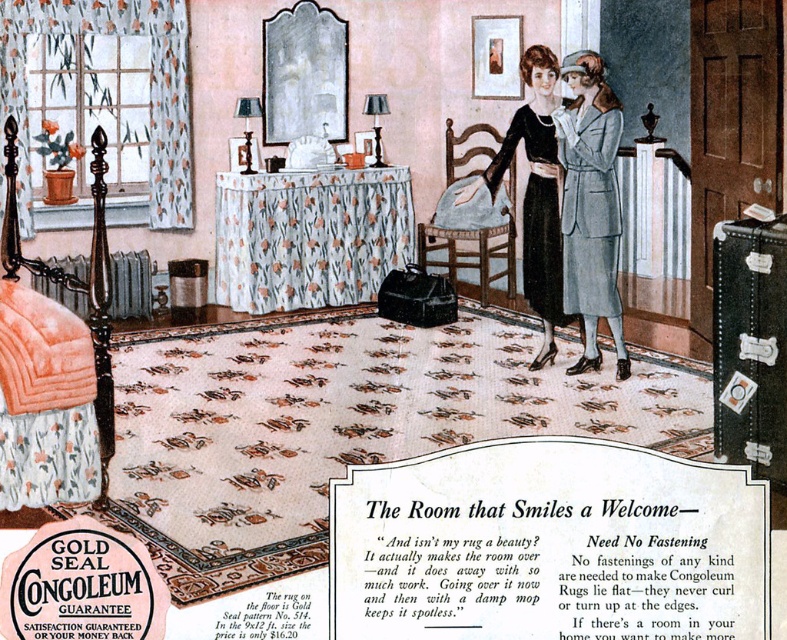
Question: Among these objects, which one is farthest from the camera?

Choices:
 (A) light gray wool suit at center
 (B) matte black dress at center
 (C) white carpet at center

Answer: (B)

Question: Does white carpet at center have a smaller size compared to matte black dress at center?

Choices:
 (A) yes
 (B) no

Answer: (A)

Question: Is the position of white carpet at center less distant than that of light gray wool suit at center?

Choices:
 (A) no
 (B) yes

Answer: (B)

Question: Which object is closer to the camera taking this photo?

Choices:
 (A) white carpet at center
 (B) light gray wool suit at center

Answer: (A)

Question: Which of the following is the closest to the observer?

Choices:
 (A) (508, 161)
 (B) (386, 592)

Answer: (B)

Question: Is white carpet at center above matte black dress at center?

Choices:
 (A) yes
 (B) no

Answer: (B)